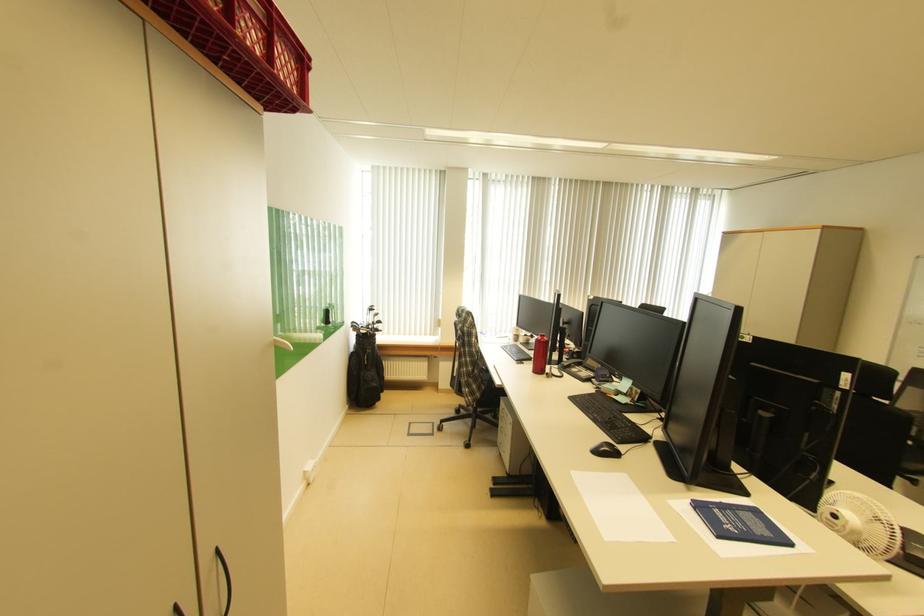
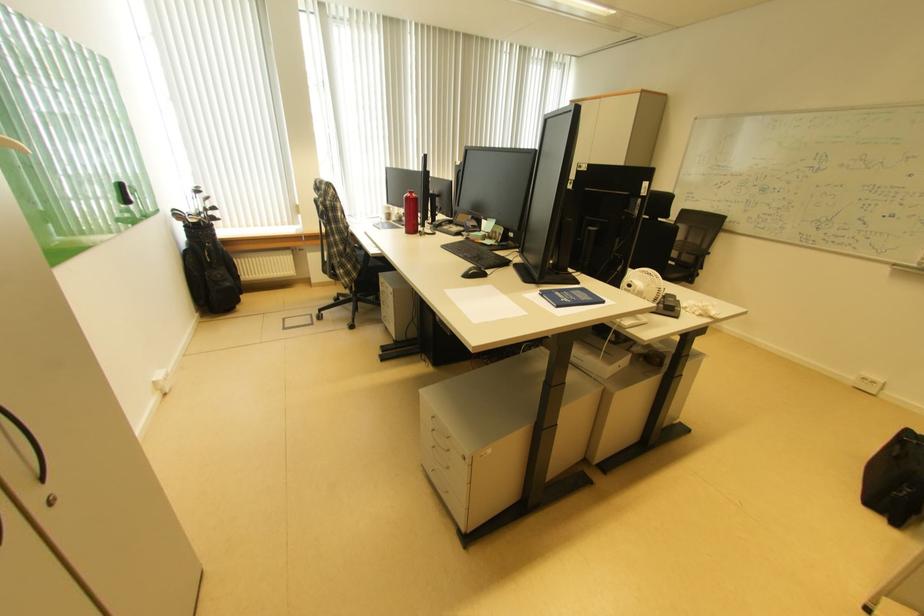
Where in the second image is the point corresponding to point 703,511 from the first image?

(551, 297)